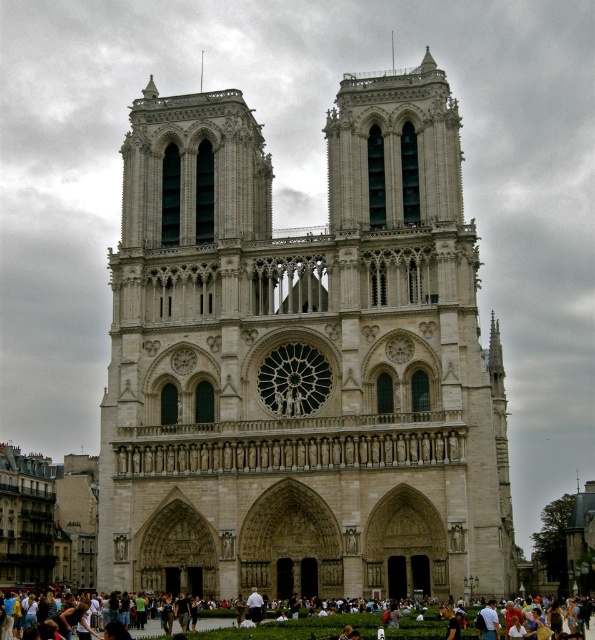
Question: Which of the following is the farthest from the observer?

Choices:
 (A) light brown leather bag at lower center
 (B) white stone church at center

Answer: (B)

Question: From the image, what is the correct spatial relationship of white stone church at center in relation to light brown leather bag at lower center?

Choices:
 (A) above
 (B) below

Answer: (A)

Question: Is white stone church at center to the left of light brown leather bag at lower center from the viewer's perspective?

Choices:
 (A) no
 (B) yes

Answer: (A)

Question: Can you confirm if white stone church at center is wider than light brown leather bag at lower center?

Choices:
 (A) no
 (B) yes

Answer: (B)

Question: Which point appears closest to the camera in this image?

Choices:
 (A) (361, 625)
 (B) (364, 301)

Answer: (A)

Question: Which point is closer to the camera?

Choices:
 (A) (380, 264)
 (B) (299, 624)

Answer: (B)